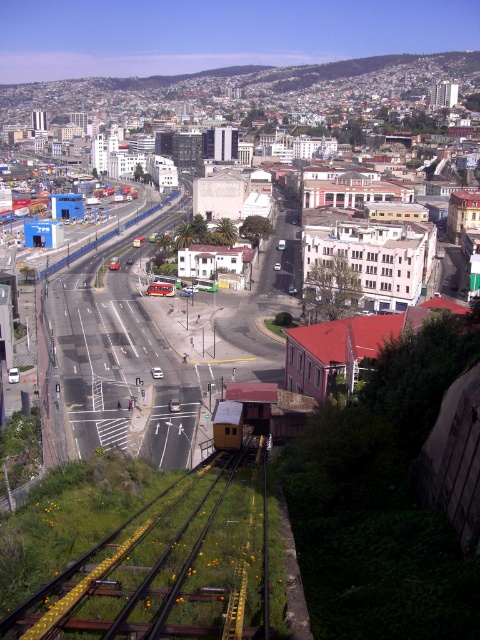
Question: Considering the relative positions of yellow metal train track at lower center and yellow metallic train at center in the image provided, where is yellow metal train track at lower center located with respect to yellow metallic train at center?

Choices:
 (A) right
 (B) left

Answer: (A)

Question: Which object is closer to the camera taking this photo?

Choices:
 (A) yellow metal train track at lower center
 (B) yellow metallic train at center

Answer: (A)

Question: Can you confirm if yellow metal train track at lower center is positioned below yellow metallic train at center?

Choices:
 (A) yes
 (B) no

Answer: (A)

Question: Which of the following is the farthest from the observer?

Choices:
 (A) yellow metallic train at center
 (B) yellow metal train track at lower center

Answer: (A)

Question: Can you confirm if yellow metal train track at lower center is positioned above yellow metallic train at center?

Choices:
 (A) no
 (B) yes

Answer: (A)